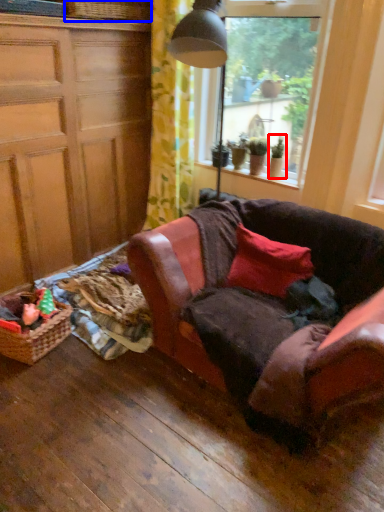
Question: Which of the following is the closest to the observer, houseplant (highlighted by a red box) or basket (highlighted by a blue box)?

Choices:
 (A) houseplant
 (B) basket

Answer: (B)